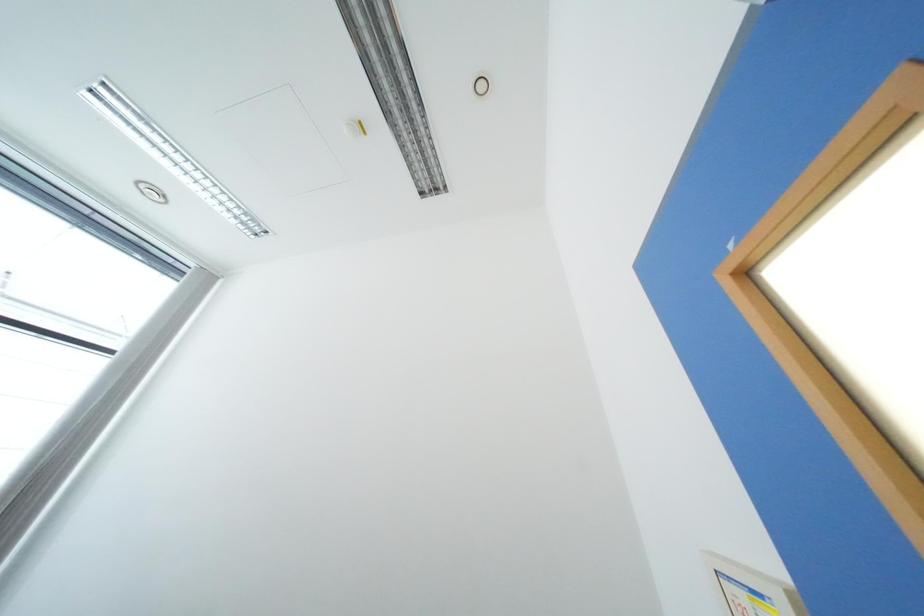
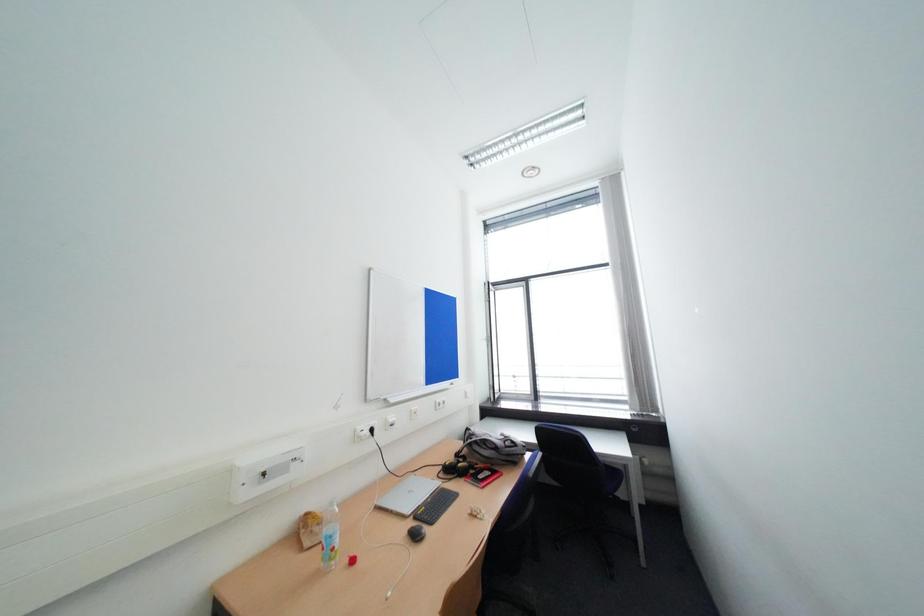
The images are taken continuously from a first-person perspective. In which direction is your viewpoint rotating?

The camera's rotation is toward left-up.